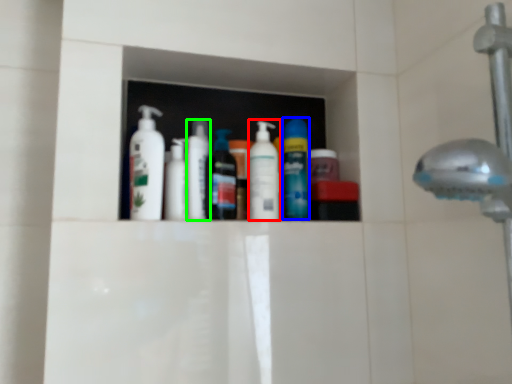
Question: Based on their relative distances, which object is farther from cleaning product (highlighted by a red box)? Choose from mouthwash (highlighted by a blue box) and toiletry (highlighted by a green box).

Choices:
 (A) mouthwash
 (B) toiletry

Answer: (B)